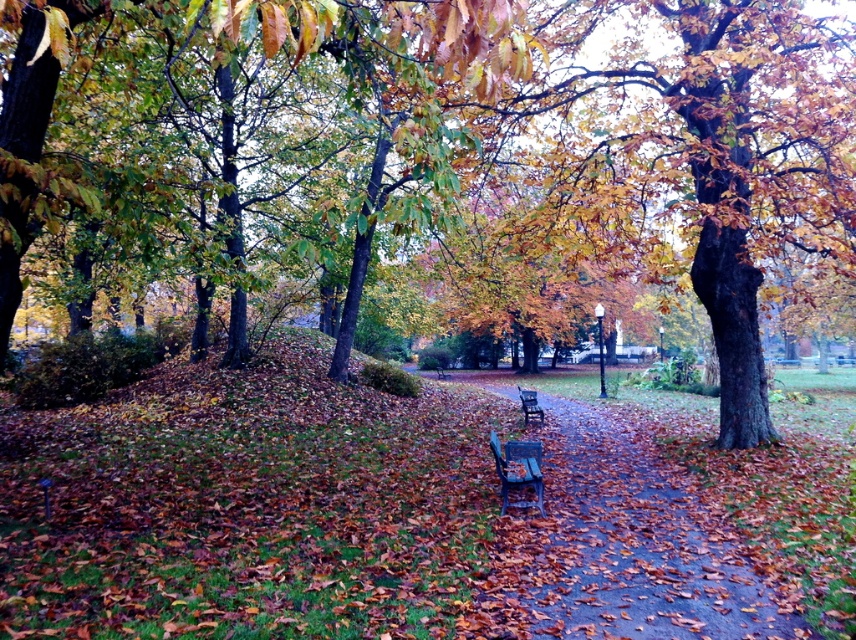
Question: Can you confirm if smooth concrete path at center is positioned to the right of wooden bench at center?

Choices:
 (A) yes
 (B) no

Answer: (A)

Question: Which of the following is the closest to the observer?

Choices:
 (A) (503, 460)
 (B) (521, 410)

Answer: (A)

Question: From the image, what is the correct spatial relationship of wooden bench at center in relation to dark brown wooden bench at center?

Choices:
 (A) below
 (B) above

Answer: (B)

Question: Which of these objects is positioned farthest from the smooth concrete path at center?

Choices:
 (A) wooden bench at center
 (B) dark brown wooden bench at center

Answer: (B)

Question: Which object is closer to the camera taking this photo?

Choices:
 (A) smooth concrete path at center
 (B) wooden bench at center
 (C) dark brown wooden bench at center

Answer: (A)

Question: Is the position of smooth concrete path at center more distant than that of dark brown wooden bench at center?

Choices:
 (A) yes
 (B) no

Answer: (B)